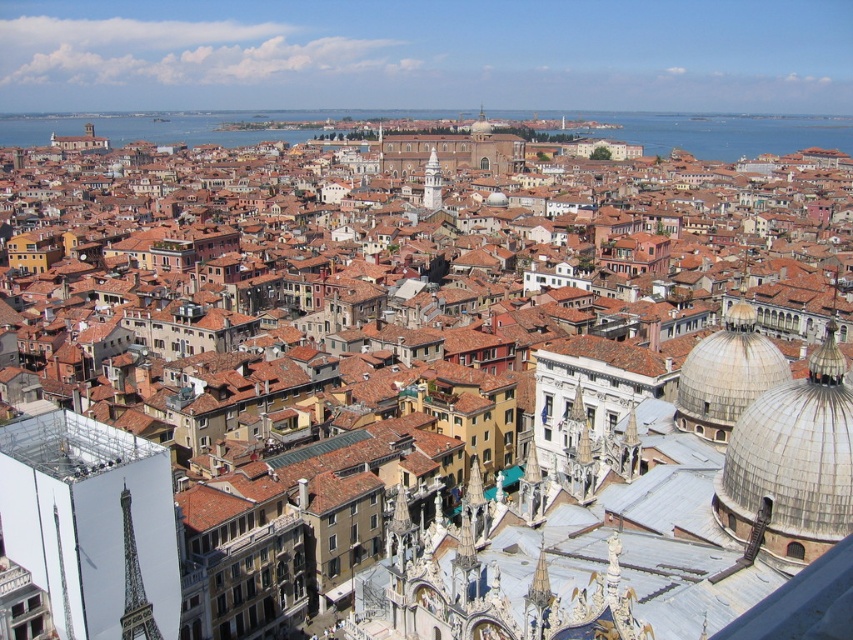
You are a tourist in Venice, and you want to take a photo of the shiny silver tower at lower left without the blue water at center blocking it. How should you position yourself to achieve this?

The shiny silver tower at lower left is behind the blue water at center, so you should move to a position where you can see behind the blue water at center to capture the shiny silver tower at lower left without obstruction.

You are an architect visiting Venice and want to compare the heights of the smooth white dome at upper right and the shiny silver tower at lower left. Based on the scene, which one is taller?

The smooth white dome at upper right is taller than the shiny silver tower at lower left according to the description.